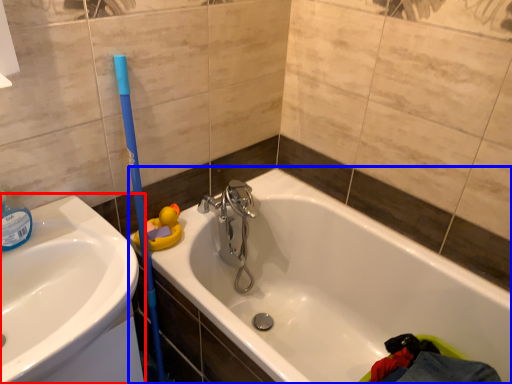
Question: Among these objects, which one is nearest to the camera, sink (highlighted by a red box) or bathtub (highlighted by a blue box)?

Choices:
 (A) sink
 (B) bathtub

Answer: (B)